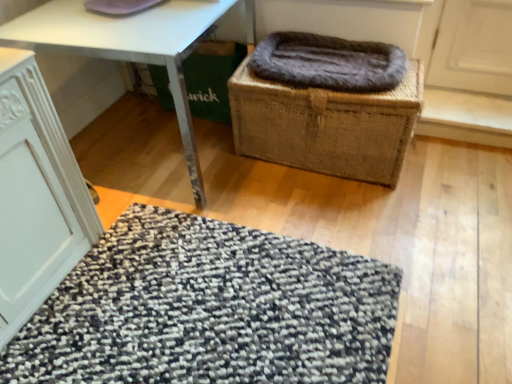
In order to click on vacant region above textured gray mat at lower center (from a real-world perspective) in this screenshot , I will do `click(202, 300)`.